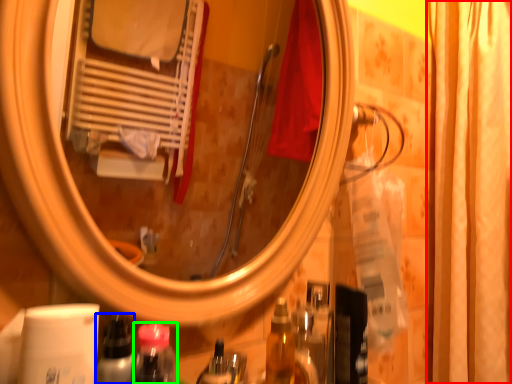
Question: Estimate the real-world distances between objects in this image. Which object is closer to shower curtain (highlighted by a red box), bottle (highlighted by a blue box) or mouthwash (highlighted by a green box)?

Choices:
 (A) bottle
 (B) mouthwash

Answer: (B)